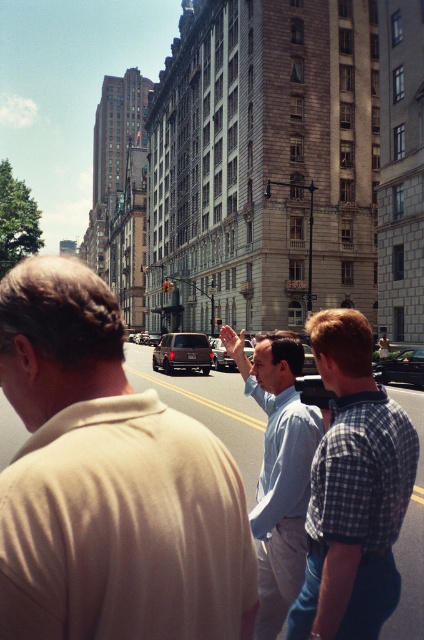
You are a photographer trying to capture a clear shot of both point (49, 605) and point (217, 364) in the image. Which point should you focus on first to ensure both are in focus?

You should focus on point (49, 605) first because it is closer to the camera than point (217, 364). By focusing on the closer point, the farther point will also be within the depth of field, ensuring both are in focus.

You are a delivery person with a box that is 1.5 meters wide. You need to navigate through the space between the beige cotton shirt at center and the light blue shirt at center. Can your box fit through the gap between them?

The distance between the beige cotton shirt at center and light blue shirt at center is 1.62 meters. Since your box is 1.5 meters wide, it can fit through the gap as the available space is wider than the box.